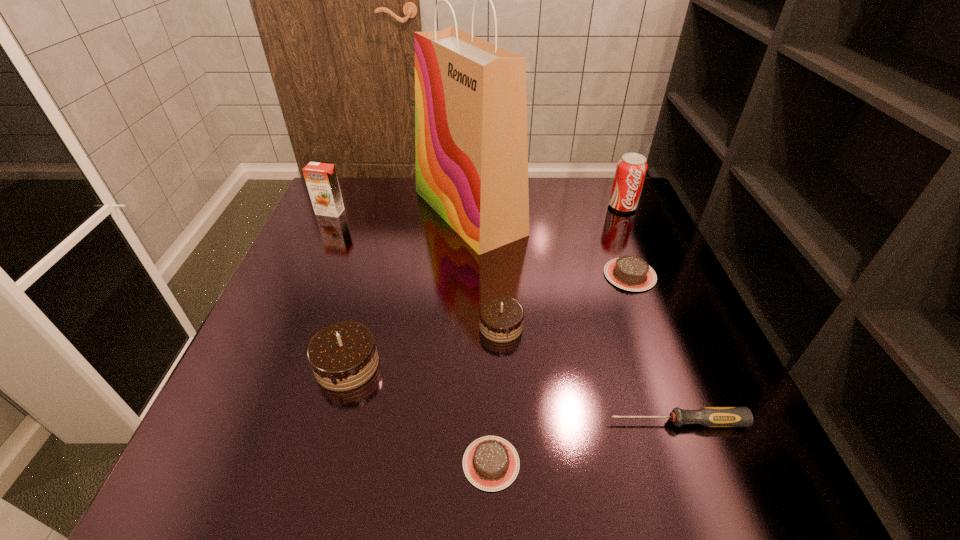
Find the location of a particular element. This screenshot has width=960, height=540. screwdriver that is at the right edge is located at coordinates (708, 416).

The width and height of the screenshot is (960, 540). What are the coordinates of `chocolate cake that is positioned at the right edge` in the screenshot? It's located at (631, 273).

Image resolution: width=960 pixels, height=540 pixels. In order to click on object present at the far left corner in this screenshot , I will do `click(321, 179)`.

Find the location of a particular element. This screenshot has width=960, height=540. object at the far right corner is located at coordinates (631, 169).

The image size is (960, 540). I want to click on vacant space at the far edge, so click(395, 178).

The width and height of the screenshot is (960, 540). Find the location of `vacant space at the left edge`. vacant space at the left edge is located at coordinates (340, 308).

What are the coordinates of `free space at the right edge` in the screenshot? It's located at [667, 253].

Locate an element on the screen. free region at the far left corner of the desktop is located at coordinates (334, 218).

You are a GUI agent. You are given a task and a screenshot of the screen. Output one action in this format:
    pyautogui.click(x=<x>, y=<y>)
    Task: Click on the free space at the far right corner of the desktop
    
    Given the screenshot: What is the action you would take?
    pyautogui.click(x=599, y=191)

In the image, there is a desktop. Identify the location of vacant space at the near right corner. The height and width of the screenshot is (540, 960). (760, 481).